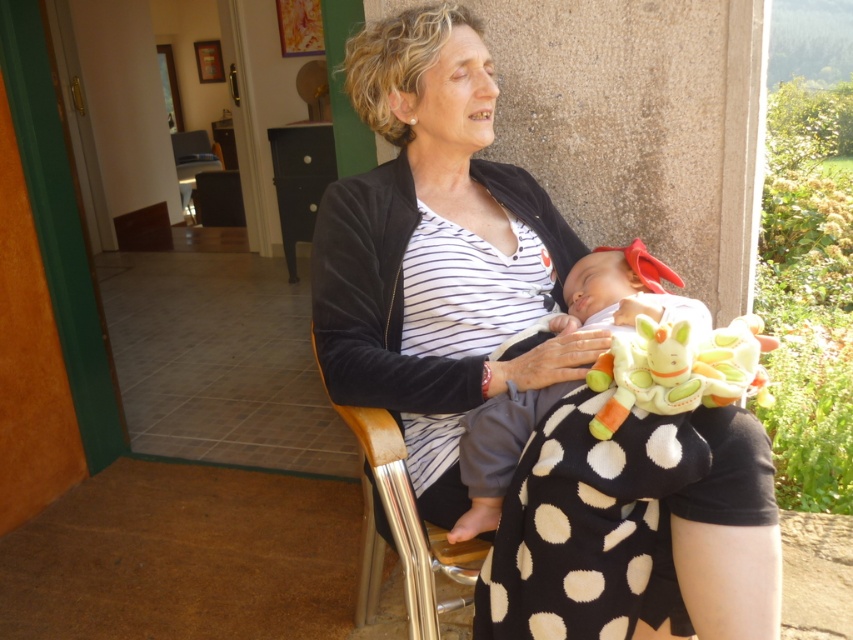
Question: Does white soft baby at center lie in front of metallic silver chair at center?

Choices:
 (A) yes
 (B) no

Answer: (A)

Question: Does white soft baby at center appear under metallic silver chair at center?

Choices:
 (A) yes
 (B) no

Answer: (B)

Question: Estimate the real-world distances between objects in this image. Which object is closer to the white soft baby at center?

Choices:
 (A) striped fabric shirt at center
 (B) matte black chair at center
 (C) fluffy plush toy at lap

Answer: (C)

Question: Which object appears closest to the camera in this image?

Choices:
 (A) fluffy plush toy at lap
 (B) metallic silver chair at center
 (C) striped fabric shirt at center

Answer: (A)

Question: Which object is closer to the camera taking this photo?

Choices:
 (A) white soft baby at center
 (B) fluffy plush toy at lap
 (C) striped fabric shirt at center
 (D) matte black chair at center

Answer: (B)

Question: Can you confirm if striped fabric shirt at center is smaller than metallic silver chair at center?

Choices:
 (A) yes
 (B) no

Answer: (B)